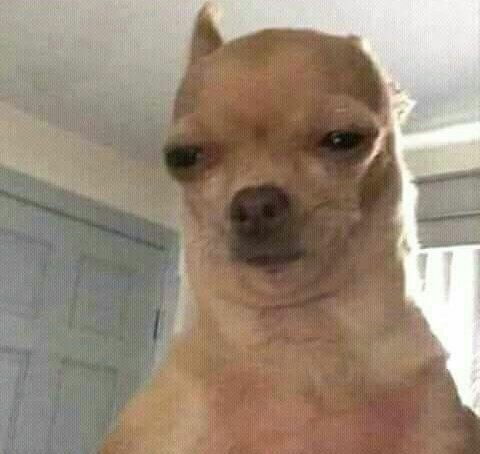
The width and height of the screenshot is (480, 454). I want to click on door, so click(46, 340).